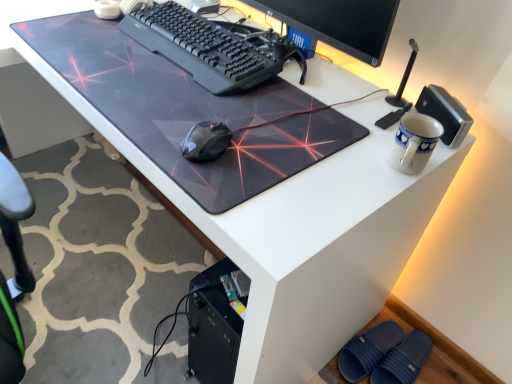
The height and width of the screenshot is (384, 512). I want to click on blue ceramic mug at upper right, so click(x=414, y=142).

Based on the photo, does blue rubber slippers at lower right have a lesser height compared to blue ceramic mug at upper right?

Indeed, blue rubber slippers at lower right has a lesser height compared to blue ceramic mug at upper right.

Which is correct: blue rubber slippers at lower right is inside blue ceramic mug at upper right, or outside of it?

blue rubber slippers at lower right is outside blue ceramic mug at upper right.

What's the angular difference between blue rubber slippers at lower right and blue ceramic mug at upper right's facing directions?

They differ by 3.52 degrees in their facing directions.

Is blue rubber slippers at lower right facing towards blue ceramic mug at upper right?

No, blue rubber slippers at lower right does not turn towards blue ceramic mug at upper right.

Between transparent plastic mousepad at center and black plastic keyboard at center, which one has more height?

black plastic keyboard at center is taller.

Consider the image. Is transparent plastic mousepad at center not near black plastic keyboard at center?

No, transparent plastic mousepad at center is not far from black plastic keyboard at center.

Is transparent plastic mousepad at center oriented away from black plastic keyboard at center?

transparent plastic mousepad at center does not have its back to black plastic keyboard at center.

Is transparent plastic mousepad at center at the back of blue rubber slippers at lower right?

No, transparent plastic mousepad at center is not at the back of blue rubber slippers at lower right.

From a real-world perspective, is blue rubber slippers at lower right physically located above or below transparent plastic mousepad at center?

Clearly, from a real-world perspective, blue rubber slippers at lower right is below transparent plastic mousepad at center.

In the image, is blue rubber slippers at lower right positioned in front of or behind transparent plastic mousepad at center?

Visually, blue rubber slippers at lower right is located behind transparent plastic mousepad at center.

Locate an element on the screen. This screenshot has height=384, width=512. footwear below the transparent plastic mousepad at center (from a real-world perspective) is located at coordinates (368, 350).

Is blue ceramic mug at upper right closer to the viewer compared to black plastic keyboard at center?

Yes.

Based on their sizes in the image, would you say blue ceramic mug at upper right is bigger or smaller than black plastic keyboard at center?

blue ceramic mug at upper right is smaller than black plastic keyboard at center.

Which of these two, blue ceramic mug at upper right or black plastic keyboard at center, stands taller?

With more height is blue ceramic mug at upper right.

Is the position of black plastic keyboard at center more distant than that of blue textured slipper at lower right?

No.

The height and width of the screenshot is (384, 512). I want to click on computer keyboard on the left side of blue textured slipper at lower right, so [201, 48].

From the image's perspective, relative to blue textured slipper at lower right, is black plastic keyboard at center above or below?

black plastic keyboard at center is situated higher than blue textured slipper at lower right in the image.

Considering the points (191, 48) and (373, 375), which point is in front, point (191, 48) or point (373, 375)?

The point (191, 48) is in front.

Could you tell me if blue textured slipper at lower right is facing black plastic keyboard at center?

No, blue textured slipper at lower right is not oriented towards black plastic keyboard at center.

From a real-world perspective, which object rests below the other?

In real-world perspective, blue textured slipper at lower right is lower.

How many degrees apart are the facing directions of blue textured slipper at lower right and black plastic keyboard at center?

There is a 1.66-degree angle between the facing directions of blue textured slipper at lower right and black plastic keyboard at center.

Which is in front, point (416, 352) or point (222, 83)?

The point (222, 83) is in front.

Is black plastic keyboard at center not close to blue ceramic mug at upper right?

No, black plastic keyboard at center is in close proximity to blue ceramic mug at upper right.

Based on the photo, considering the relative positions of black plastic keyboard at center and blue ceramic mug at upper right in the image provided, is black plastic keyboard at center to the left of blue ceramic mug at upper right from the viewer's perspective?

Yes.

From the picture: Who is taller, black plastic keyboard at center or blue ceramic mug at upper right?

blue ceramic mug at upper right is taller.

Locate an element on the screen. mug above the blue rubber slippers at lower right (from the image's perspective) is located at coordinates (414, 142).

Locate an element on the screen. The height and width of the screenshot is (384, 512). computer keyboard on the right of transparent plastic mousepad at center is located at coordinates (201, 48).

When comparing their distances from blue textured slipper at lower right, does transparent plastic mousepad at center or blue rubber slippers at lower right seem further?

transparent plastic mousepad at center lies further to blue textured slipper at lower right than the other object.

From the image, which object appears to be nearer to blue ceramic mug at upper right, blue rubber slippers at lower right or transparent plastic mousepad at center?

The object closer to blue ceramic mug at upper right is transparent plastic mousepad at center.

When comparing their distances from blue textured slipper at lower right, does blue rubber slippers at lower right or blue ceramic mug at upper right seem further?

blue ceramic mug at upper right is further to blue textured slipper at lower right.

Looking at the image, which one is located closer to blue textured slipper at lower right, black plastic keyboard at center or blue ceramic mug at upper right?

blue ceramic mug at upper right lies closer to blue textured slipper at lower right than the other object.

Which object lies further to the anchor point blue rubber slippers at lower right, blue ceramic mug at upper right or blue textured slipper at lower right?

Based on the image, blue ceramic mug at upper right appears to be further to blue rubber slippers at lower right.

Which object lies further to the anchor point black plastic keyboard at center, blue ceramic mug at upper right or blue rubber slippers at lower right?

blue rubber slippers at lower right lies further to black plastic keyboard at center than the other object.

Looking at the image, which one is located closer to black plastic keyboard at center, blue rubber slippers at lower right or transparent plastic mousepad at center?

Based on the image, transparent plastic mousepad at center appears to be nearer to black plastic keyboard at center.

Estimate the real-world distances between objects in this image. Which object is further from blue rubber slippers at lower right, blue textured slipper at lower right or transparent plastic mousepad at center?

The object further to blue rubber slippers at lower right is transparent plastic mousepad at center.

Find the location of `footwear between transparent plastic mousepad at center and blue textured slipper at lower right in the vertical direction`. footwear between transparent plastic mousepad at center and blue textured slipper at lower right in the vertical direction is located at coordinates (368, 350).

Identify the location of mug between black plastic keyboard at center and blue textured slipper at lower right from top to bottom. The image size is (512, 384). (414, 142).

Identify the location of mug between black plastic keyboard at center and blue rubber slippers at lower right from top to bottom. (414, 142).

You are a GUI agent. You are given a task and a screenshot of the screen. Output one action in this format:
    pyautogui.click(x=<x>, y=<y>)
    Task: Click on the mug between transparent plastic mousepad at center and blue textured slipper at lower right from top to bottom
    The width and height of the screenshot is (512, 384).
    Given the screenshot: What is the action you would take?
    pyautogui.click(x=414, y=142)